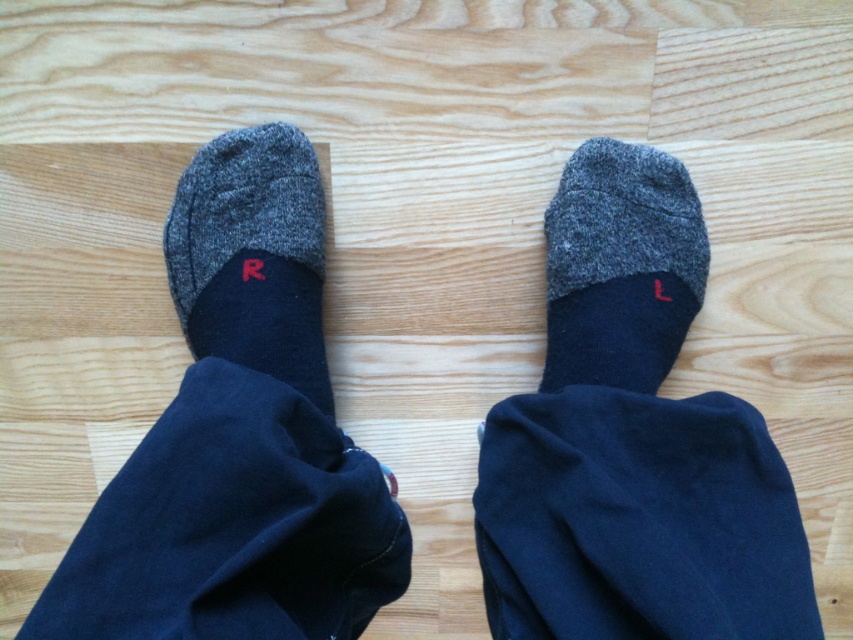
Does gray woolen sock at center have a lesser width compared to dark gray wool sock at left?

No.

Between gray woolen sock at center and dark gray wool sock at left, which one appears on the left side from the viewer's perspective?

From the viewer's perspective, dark gray wool sock at left appears more on the left side.

Does point (610, 365) come farther from viewer compared to point (277, 301)?

No, (610, 365) is in front of (277, 301).

Image resolution: width=853 pixels, height=640 pixels. Find the location of `gray woolen sock at center`. gray woolen sock at center is located at coordinates (619, 266).